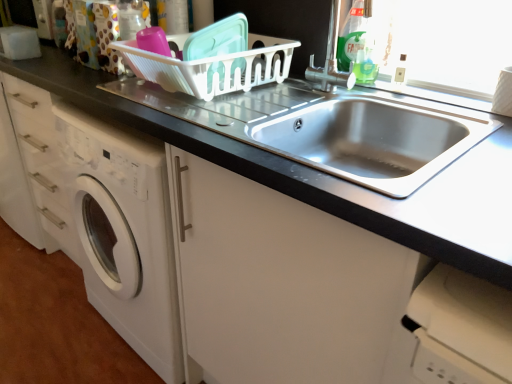
Question: Would you say green plastic bottle at upper right is part of white plastic basket at upper center's contents?

Choices:
 (A) yes
 (B) no

Answer: (B)

Question: Does white plastic basket at upper center have a lesser width compared to green plastic bottle at upper right?

Choices:
 (A) yes
 (B) no

Answer: (B)

Question: Is white plastic basket at upper center closer to camera compared to green plastic bottle at upper right?

Choices:
 (A) yes
 (B) no

Answer: (A)

Question: From the image's perspective, is white plastic basket at upper center on green plastic bottle at upper right?

Choices:
 (A) yes
 (B) no

Answer: (B)

Question: From the image's perspective, would you say white plastic basket at upper center is shown under green plastic bottle at upper right?

Choices:
 (A) no
 (B) yes

Answer: (B)

Question: From the image's perspective, is stainless steel sink at center positioned above or below stainless steel sink at center?

Choices:
 (A) below
 (B) above

Answer: (B)

Question: Do you think stainless steel sink at center is within stainless steel sink at center, or outside of it?

Choices:
 (A) outside
 (B) inside

Answer: (B)

Question: Considering their positions, is stainless steel sink at center located in front of or behind stainless steel sink at center?

Choices:
 (A) front
 (B) behind

Answer: (B)

Question: In terms of width, does stainless steel sink at center look wider or thinner when compared to stainless steel sink at center?

Choices:
 (A) thin
 (B) wide

Answer: (A)

Question: In terms of width, does green plastic bottle at upper right look wider or thinner when compared to satin nickel faucet at upper right?

Choices:
 (A) thin
 (B) wide

Answer: (B)

Question: From a real-world perspective, relative to satin nickel faucet at upper right, is green plastic bottle at upper right vertically above or below?

Choices:
 (A) below
 (B) above

Answer: (B)

Question: In terms of height, does green plastic bottle at upper right look taller or shorter compared to satin nickel faucet at upper right?

Choices:
 (A) short
 (B) tall

Answer: (B)

Question: Considering the positions of green plastic bottle at upper right and satin nickel faucet at upper right in the image, is green plastic bottle at upper right bigger or smaller than satin nickel faucet at upper right?

Choices:
 (A) big
 (B) small

Answer: (A)

Question: Based on their positions, is stainless steel sink at center located to the left or right of white plastic basket at upper center?

Choices:
 (A) left
 (B) right

Answer: (B)

Question: Is stainless steel sink at center in front of or behind white plastic basket at upper center in the image?

Choices:
 (A) front
 (B) behind

Answer: (A)